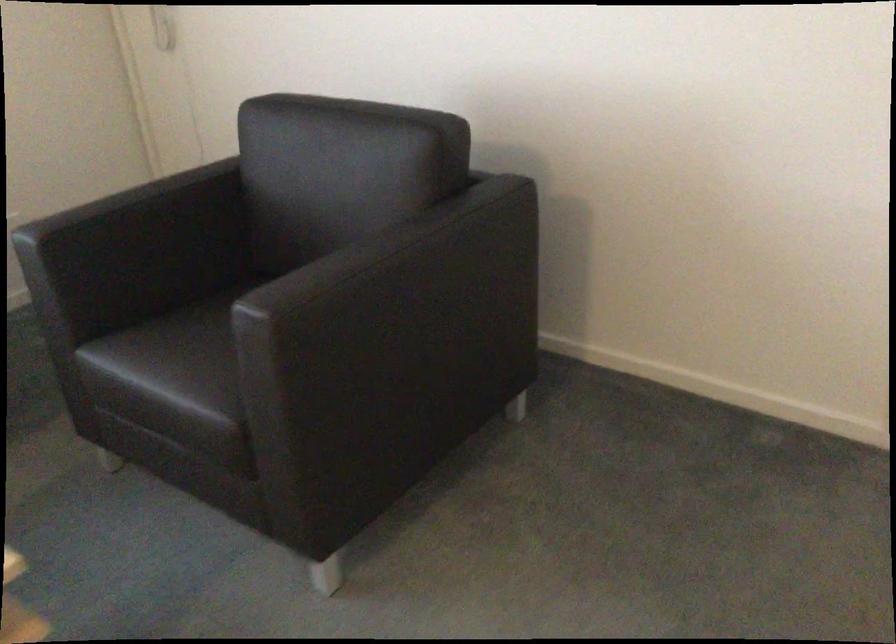
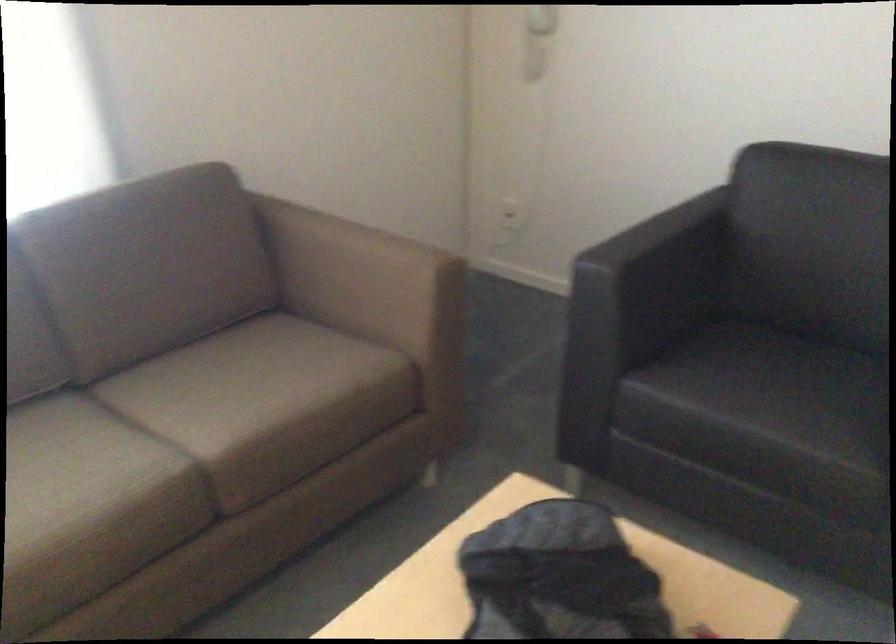
Find the pixel in the second image that matches the point at 187,357 in the first image.

(765, 397)